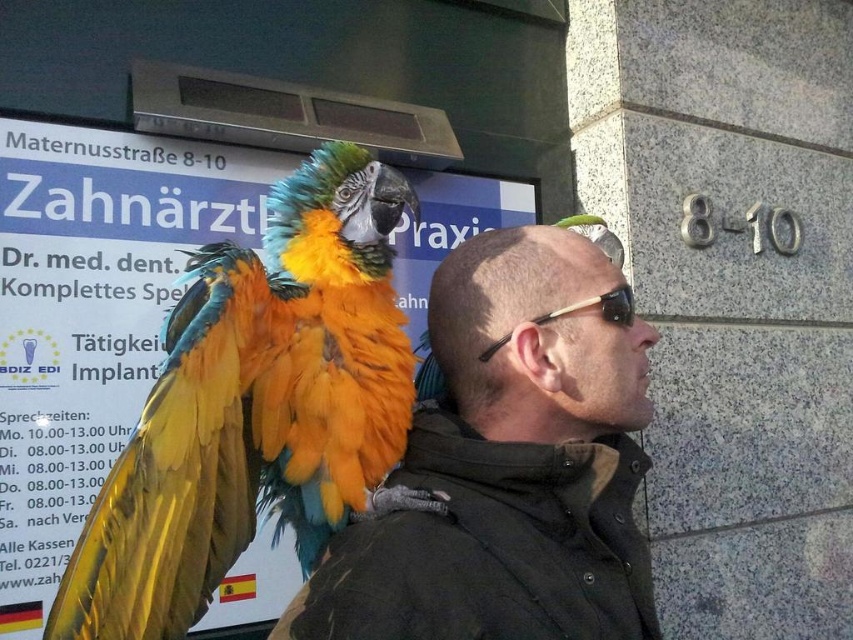
You are trying to determine if the matte black jacket at center can completely cover the shiny black sunglasses at center. Based on their sizes, is this possible?

The matte black jacket at center might be wider than shiny black sunglasses at center, so it is possible that the jacket could cover the sunglasses if positioned correctly.

You are a photographer trying to capture the vibrant parrot on the person wearing the matte black jacket at center. Based on the coordinates provided, where exactly should you focus your camera to ensure the parrot is in the frame?

The matte black jacket at center is located at point (509, 464), so focusing your camera there will ensure the parrot perched on the person is in the frame.

You are a photographer trying to capture the shiny multicolored parrot at center and the matte black jacket at center in a single frame. Which object should you zoom in on to ensure both fit in the frame without cropping?

The shiny multicolored parrot at center is narrower than the matte black jacket at center, so you should zoom in on the wider matte black jacket at center to ensure both fit in the frame without cropping.